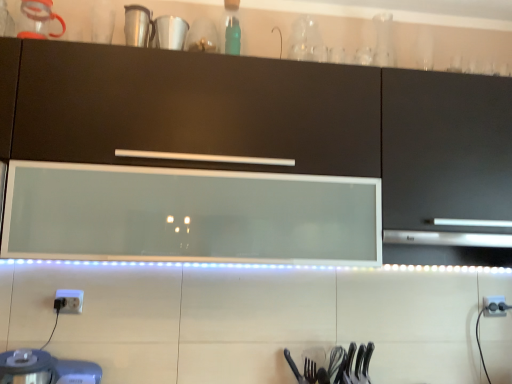
Question: Does white plastic electric outlet at lower right, the first electric outlet in the bottom-to-top sequence, have a smaller size compared to polished metal fork at lower center?

Choices:
 (A) no
 (B) yes

Answer: (A)

Question: Can polished metal fork at lower center be found inside white plastic electric outlet at lower right, the second electric outlet when ordered from left to right?

Choices:
 (A) yes
 (B) no

Answer: (B)

Question: Could you tell me if white plastic electric outlet at lower right, the first electric outlet when ordered from right to left, is facing polished metal fork at lower center?

Choices:
 (A) no
 (B) yes

Answer: (A)

Question: Is white plastic electric outlet at lower right, the first electric outlet when ordered from right to left, positioned with its back to polished metal fork at lower center?

Choices:
 (A) no
 (B) yes

Answer: (A)

Question: From a real-world perspective, is white plastic electric outlet at lower right, the first electric outlet when ordered from right to left, on polished metal fork at lower center?

Choices:
 (A) yes
 (B) no

Answer: (A)

Question: Does point (486, 299) appear closer or farther from the camera than point (76, 306)?

Choices:
 (A) closer
 (B) farther

Answer: (B)

Question: Is white plastic electric outlet at lower right, which is the second electric outlet from front to back, situated inside white plastic electric outlet at lower left, which ranks as the second electric outlet in bottom-to-top order, or outside?

Choices:
 (A) inside
 (B) outside

Answer: (B)

Question: Is white plastic electric outlet at lower right, which appears as the second electric outlet when viewed from the top, to the left or to the right of white plastic electric outlet at lower left, which is counted as the 2th electric outlet, starting from the back, in the image?

Choices:
 (A) right
 (B) left

Answer: (A)

Question: Looking at the image, does white plastic electric outlet at lower right, which ranks as the 1th electric outlet in back-to-front order, seem bigger or smaller compared to white plastic electric outlet at lower left, which is counted as the 2th electric outlet, starting from the back?

Choices:
 (A) small
 (B) big

Answer: (B)

Question: Do you think matte black cabinet at center is within polished metal fork at lower center, or outside of it?

Choices:
 (A) outside
 (B) inside

Answer: (A)

Question: Looking at the image, does matte black cabinet at center seem bigger or smaller compared to polished metal fork at lower center?

Choices:
 (A) small
 (B) big

Answer: (B)

Question: In terms of height, does matte black cabinet at center look taller or shorter compared to polished metal fork at lower center?

Choices:
 (A) short
 (B) tall

Answer: (B)

Question: Is point (294, 124) closer or farther from the camera than point (316, 377)?

Choices:
 (A) farther
 (B) closer

Answer: (B)

Question: Is point (186, 28) closer or farther from the camera than point (495, 302)?

Choices:
 (A) closer
 (B) farther

Answer: (A)

Question: Visually, is white glossy cup at upper center positioned to the left or to the right of white plastic electric outlet at lower right, the first electric outlet when ordered from right to left?

Choices:
 (A) right
 (B) left

Answer: (B)